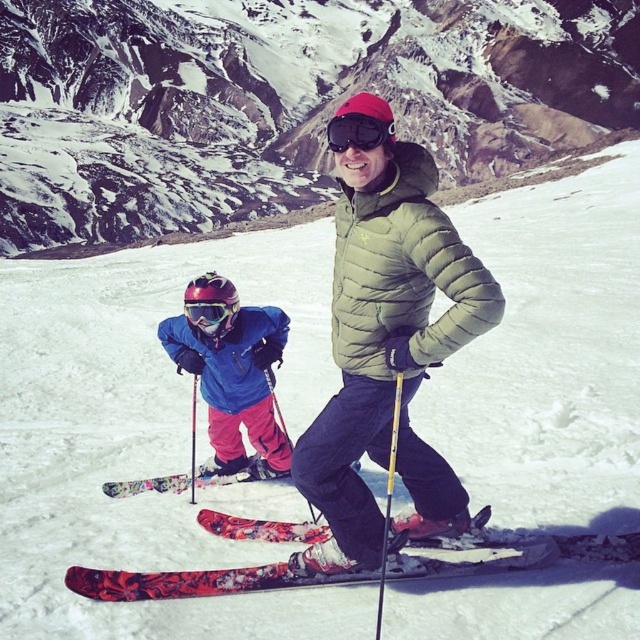
Between point (196, 28) and point (380, 268), which one is positioned behind?

The point (196, 28) is behind.

What do you see at coordinates (282, 102) in the screenshot?
I see `snowy granite mountain at upper center` at bounding box center [282, 102].

I want to click on snowy granite mountain at upper center, so coord(282,102).

Can you confirm if floral-patterned skis at center is bigger than blue matte ski jacket at lower left?

No.

Does floral-patterned skis at center come behind blue matte ski jacket at lower left?

No, floral-patterned skis at center is closer to the viewer.

Is point (266, 520) in front of point (237, 308)?

That is True.

Where is `floral-patterned skis at center`? This screenshot has height=640, width=640. floral-patterned skis at center is located at coordinates (205, 580).

Does yellow wood ski pole at center come behind matte black goggles at center?

No, yellow wood ski pole at center is in front of matte black goggles at center.

Which is above, yellow wood ski pole at center or matte black goggles at center?

matte black goggles at center

Which is behind, point (396, 417) or point (211, 305)?

The point (211, 305) is more distant.

Locate an element on the screen. Image resolution: width=640 pixels, height=640 pixels. yellow wood ski pole at center is located at coordinates (388, 499).